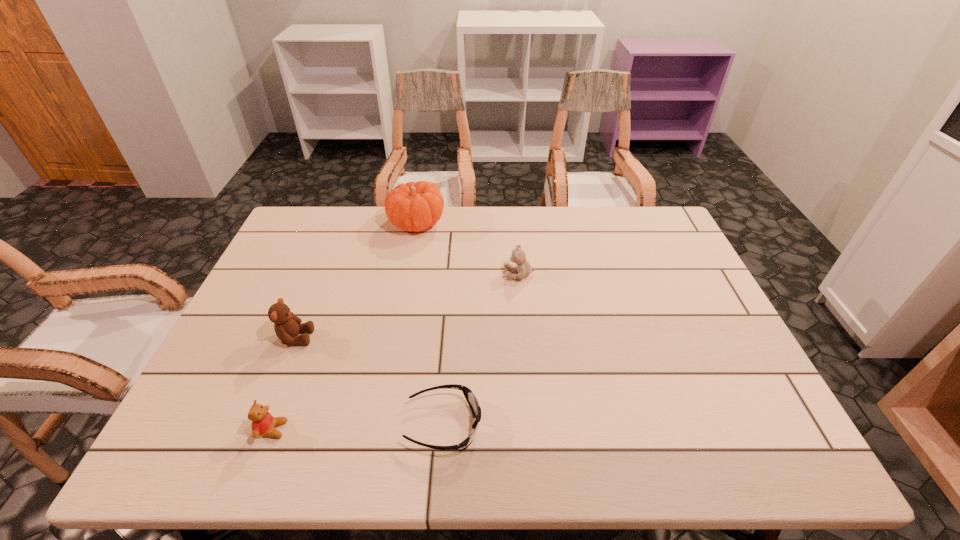
At what (x,y) coordinates should I click in order to perform the action: click on pumpkin. Please return your answer as a coordinate pair (x, y). The image size is (960, 540). Looking at the image, I should click on (413, 206).

The image size is (960, 540). I want to click on the tallest teddy bear, so click(287, 326).

Locate an element on the screen. the third nearest object is located at coordinates (287, 326).

I want to click on the farthest teddy bear, so click(x=518, y=256).

Find the location of a particular element. the second farthest object is located at coordinates pyautogui.click(x=518, y=256).

This screenshot has width=960, height=540. What are the coordinates of `the nearest teddy bear` in the screenshot? It's located at (263, 423).

Find the location of a particular element. sunglasses is located at coordinates (473, 403).

Identify the location of vacant area situated on the right of the pumpkin. The height and width of the screenshot is (540, 960). (504, 222).

You are a GUI agent. You are given a task and a screenshot of the screen. Output one action in this format:
    pyautogui.click(x=<x>, y=<y>)
    Task: Click on the blank space located on the face of the third nearest object
    The image size is (960, 540).
    Given the screenshot: What is the action you would take?
    pyautogui.click(x=457, y=338)

Identify the location of vacant space located 0.170m on the face of the farthest teddy bear. The width and height of the screenshot is (960, 540). (446, 274).